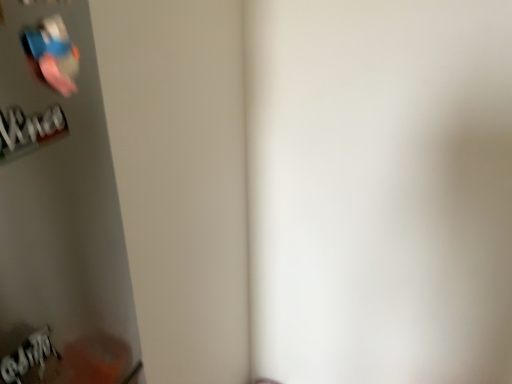
Question: Is metallic blue wii remote at upper left located within white paper at lower left, the 1th writing in the bottom-to-top sequence?

Choices:
 (A) yes
 (B) no

Answer: (B)

Question: Is white paper at lower left, the second writing in the top-to-bottom sequence, facing towards metallic blue wii remote at upper left?

Choices:
 (A) no
 (B) yes

Answer: (A)

Question: Is white paper at lower left, the second writing in the top-to-bottom sequence, smaller than metallic blue wii remote at upper left?

Choices:
 (A) no
 (B) yes

Answer: (A)

Question: Considering the relative sizes of white paper at lower left, the second writing in the top-to-bottom sequence, and metallic blue wii remote at upper left in the image provided, is white paper at lower left, the second writing in the top-to-bottom sequence, shorter than metallic blue wii remote at upper left?

Choices:
 (A) yes
 (B) no

Answer: (B)

Question: Does white paper at lower left, the 1th writing in the bottom-to-top sequence, have a lesser width compared to metallic blue wii remote at upper left?

Choices:
 (A) no
 (B) yes

Answer: (A)

Question: Is white paper at lower left, the second writing in the top-to-bottom sequence, taller than metallic blue wii remote at upper left?

Choices:
 (A) yes
 (B) no

Answer: (A)

Question: Can you confirm if metallic blue wii remote at upper left is taller than white paper at left, marked as the first writing in a top-to-bottom arrangement?

Choices:
 (A) no
 (B) yes

Answer: (B)

Question: From the image's perspective, is metallic blue wii remote at upper left below white paper at left, which is the 2th writing from bottom to top?

Choices:
 (A) yes
 (B) no

Answer: (B)

Question: Can you confirm if metallic blue wii remote at upper left is thinner than white paper at left, which is the 2th writing from bottom to top?

Choices:
 (A) no
 (B) yes

Answer: (B)

Question: Are metallic blue wii remote at upper left and white paper at left, which is the 2th writing from bottom to top, beside each other?

Choices:
 (A) yes
 (B) no

Answer: (A)

Question: Is metallic blue wii remote at upper left at the left side of white paper at left, marked as the first writing in a top-to-bottom arrangement?

Choices:
 (A) no
 (B) yes

Answer: (A)

Question: Is metallic blue wii remote at upper left completely or partially outside of white paper at left, which is the 2th writing from bottom to top?

Choices:
 (A) yes
 (B) no

Answer: (A)

Question: Can you confirm if white paper at left, marked as the first writing in a top-to-bottom arrangement, is shorter than metallic blue wii remote at upper left?

Choices:
 (A) no
 (B) yes

Answer: (B)